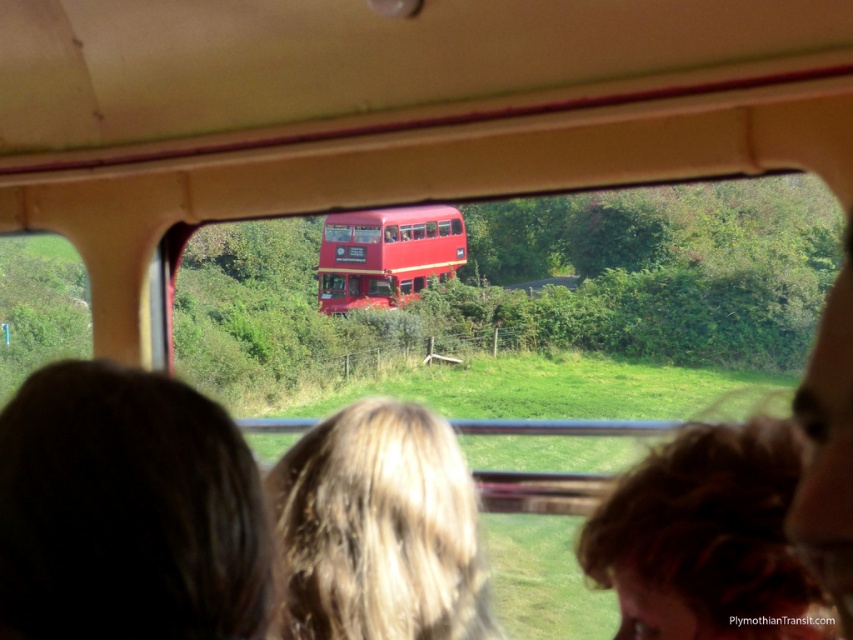
Question: Is blonde hair at center further to the viewer compared to blonde hair at lower center?

Choices:
 (A) no
 (B) yes

Answer: (A)

Question: Estimate the real-world distances between objects in this image. Which object is closer to the dark brown hair at lower left?

Choices:
 (A) blonde hair at center
 (B) blonde hair at lower center
 (C) shiny red bus at center

Answer: (A)

Question: Can you confirm if blonde hair at center is positioned below shiny red bus at center?

Choices:
 (A) no
 (B) yes

Answer: (B)

Question: Can you confirm if dark brown hair at lower left is positioned to the right of blonde hair at center?

Choices:
 (A) no
 (B) yes

Answer: (A)

Question: Which of the following is the closest to the observer?

Choices:
 (A) blonde hair at center
 (B) dark brown hair at lower left
 (C) shiny red bus at center

Answer: (B)

Question: Which point is closer to the camera?

Choices:
 (A) blonde hair at lower center
 (B) blonde hair at center

Answer: (B)